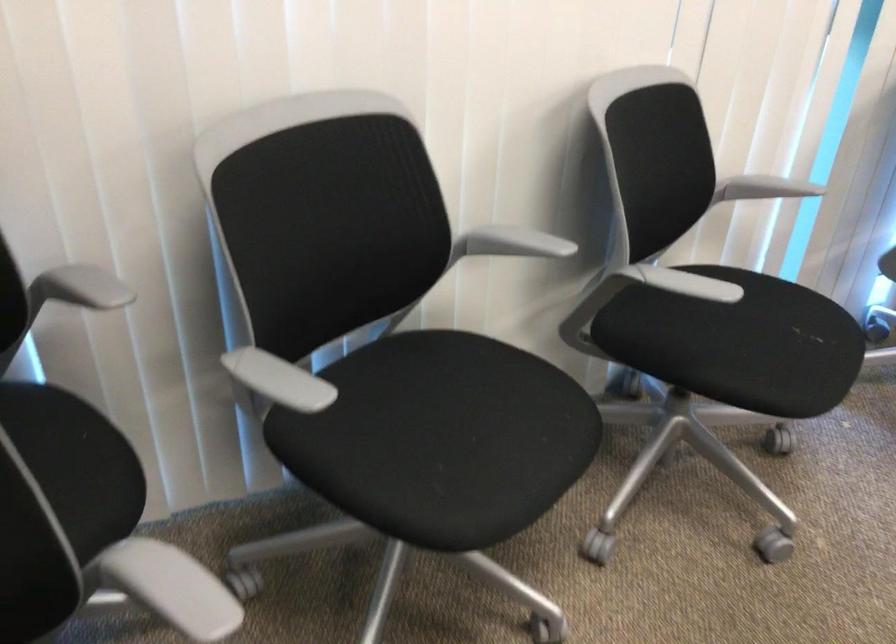
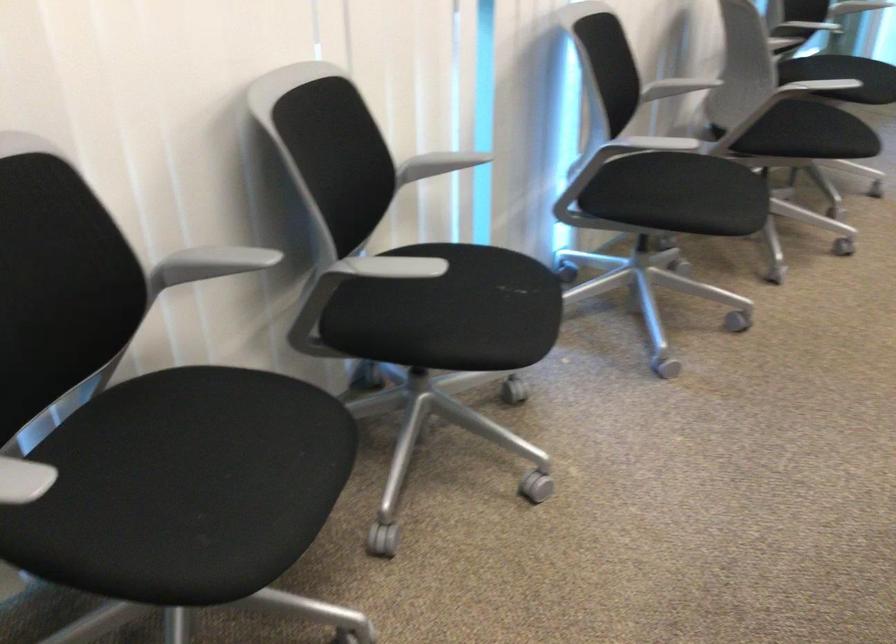
Where in the second image is the point corresponding to point 762,185 from the first image?

(438, 164)